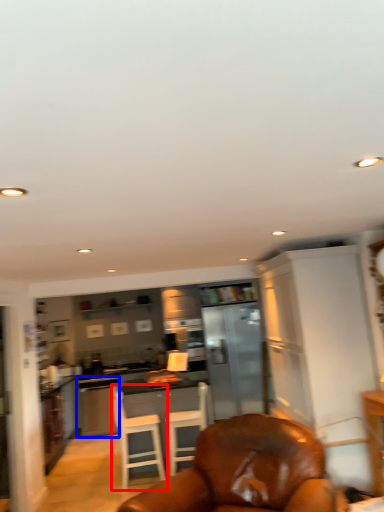
Question: Which object appears farthest to the camera in this image, chair (highlighted by a red box) or dish washer (highlighted by a blue box)?

Choices:
 (A) chair
 (B) dish washer

Answer: (B)